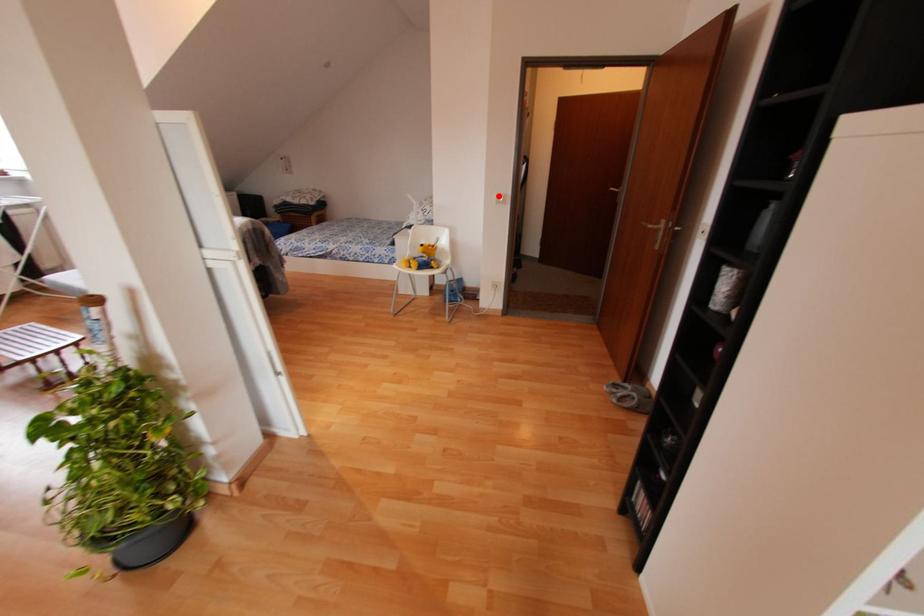
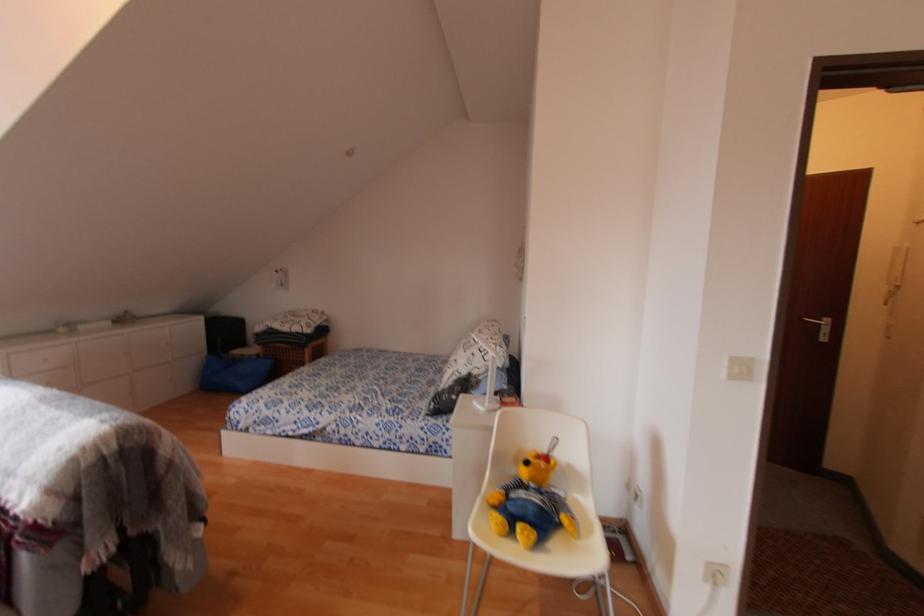
The point at the highlighted location is marked in the first image. Where is the corresponding point in the second image?

(736, 363)